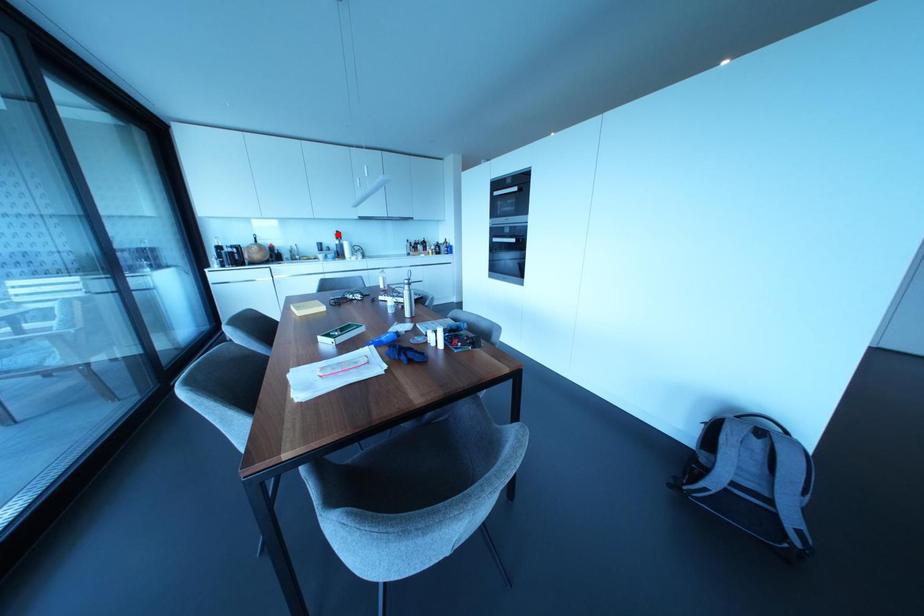
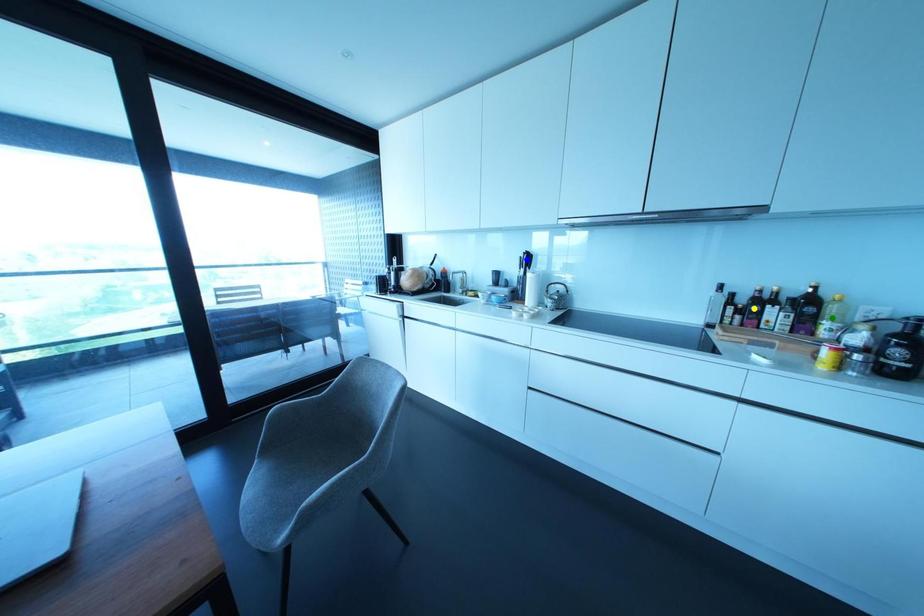
Question: I am providing you with two images of the same scene from different viewpoints. A red point is marked on the first image. You are given multiple points on the second image. Which point in image 2 represents the same 3d spot as the red point in image 1?

Choices:
 (A) blue point
 (B) green point
 (C) yellow point

Answer: (A)